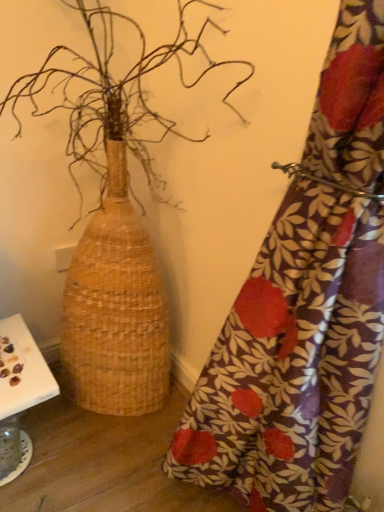
At what (x,y) coordinates should I click in order to perform the action: click on free space above white paper at lower left (from a real-world perspective). Please return your answer as a coordinate pair (x, y). Image resolution: width=384 pixels, height=512 pixels. Looking at the image, I should click on (16, 354).